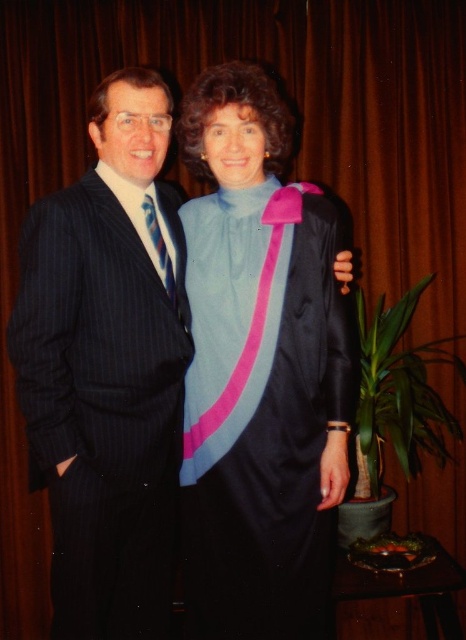
Who is lower down, satin blue dress at center or striped silk tie at left?

satin blue dress at center is lower down.

Is satin blue dress at center wider than striped silk tie at left?

Yes, satin blue dress at center is wider than striped silk tie at left.

Is point (238, 436) positioned before point (152, 208)?

That is True.

What are the coordinates of `satin blue dress at center` in the screenshot? It's located at (260, 372).

Does satin blue dress at center appear on the right side of pinstriped suit at left?

Indeed, satin blue dress at center is positioned on the right side of pinstriped suit at left.

Between point (337, 355) and point (162, 308), which one is positioned in front?

Point (162, 308) is in front.

Find the location of `satin blue dress at center`. satin blue dress at center is located at coordinates (260, 372).

Measure the distance from pinstriped suit at left to striped silk tie at left.

28.86 centimeters

Is point (35, 234) less distant than point (168, 269)?

Yes.

Is point (75, 634) farther from camera compared to point (164, 269)?

No, (75, 634) is closer to viewer.

Where is `pinstriped suit at left`? The height and width of the screenshot is (640, 466). pinstriped suit at left is located at coordinates [107, 371].